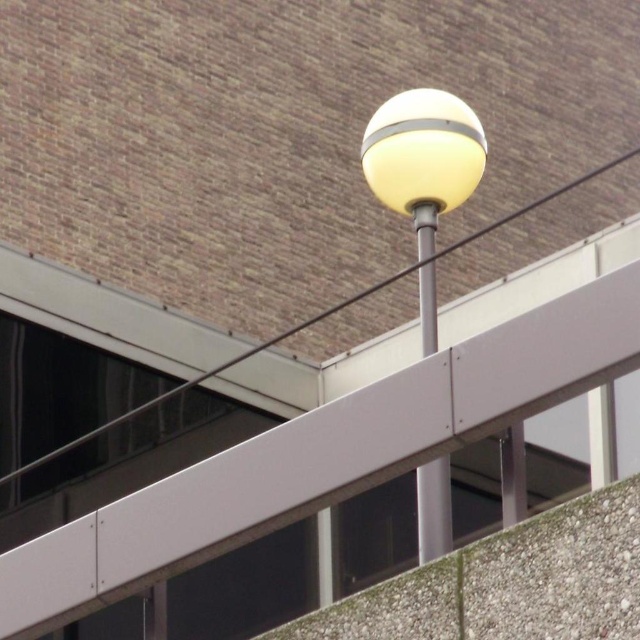
Does matte white globe at center have a lesser height compared to metallic pole at center?

In fact, matte white globe at center may be taller than metallic pole at center.

Is point (419, 212) farther from viewer compared to point (440, 468)?

Yes, it is behind point (440, 468).

I want to click on matte white globe at center, so click(422, 172).